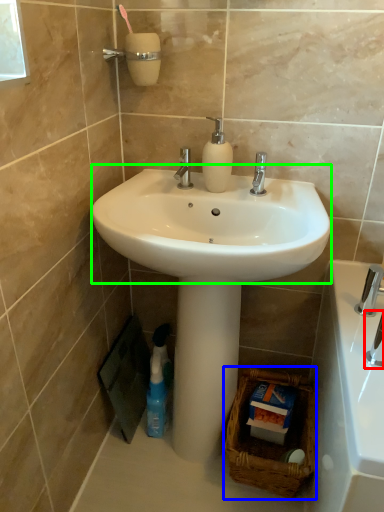
Question: Based on their relative distances, which object is nearer to plumbing fixture (highlighted by a red box)? Choose from basket (highlighted by a blue box) and sink (highlighted by a green box).

Choices:
 (A) basket
 (B) sink

Answer: (B)